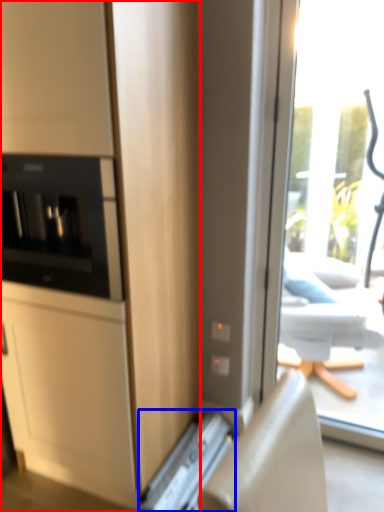
Question: Among these objects, which one is farthest to the camera, cabinetry (highlighted by a red box) or appliance (highlighted by a blue box)?

Choices:
 (A) cabinetry
 (B) appliance

Answer: (B)